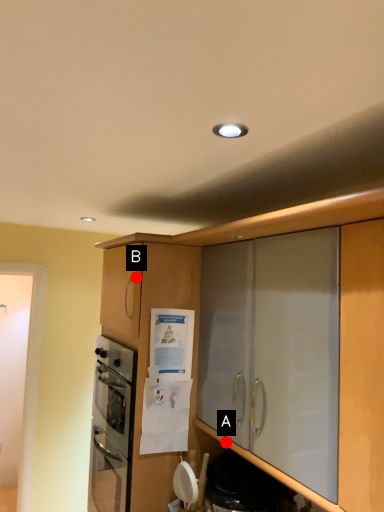
Question: Two points are circled on the image, labeled by A and B beside each circle. Which point appears closest to the camera in this image?

Choices:
 (A) A is closer
 (B) B is closer

Answer: (A)